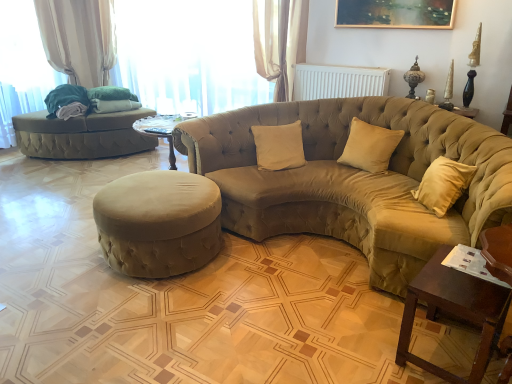
How much space does suede beige pillow at center, which ranks as the 2th pillow in left-to-right order, occupy horizontally?

12.12 inches.

The height and width of the screenshot is (384, 512). Describe the element at coordinates (369, 146) in the screenshot. I see `suede beige pillow at center, which ranks as the 2th pillow in left-to-right order` at that location.

What do you see at coordinates (354, 179) in the screenshot?
I see `velvet beige studio couch at center, the 2th studio couch in the left-to-right sequence` at bounding box center [354, 179].

Where is `white plastic radiator at upper center`? white plastic radiator at upper center is located at coordinates (338, 81).

This screenshot has width=512, height=384. What do you see at coordinates (280, 41) in the screenshot?
I see `beige fabric curtain at upper center, marked as the first curtain in a right-to-left arrangement` at bounding box center [280, 41].

This screenshot has height=384, width=512. What do you see at coordinates (158, 223) in the screenshot?
I see `suede ottoman at center` at bounding box center [158, 223].

The height and width of the screenshot is (384, 512). What do you see at coordinates (279, 146) in the screenshot?
I see `beige fabric pillow at center, the 2th pillow positioned from the right` at bounding box center [279, 146].

Identify the location of suede-like beige studio couch at left, which is the second studio couch in front-to-back order. (83, 125).

Considering the points (260, 27) and (163, 32), which point is behind, point (260, 27) or point (163, 32)?

The point (163, 32) is behind.

Is beige fabric curtain at upper center, which is counted as the first curtain, starting from the front, directly adjacent to sheer fabric curtain at upper center?

→ No, beige fabric curtain at upper center, which is counted as the first curtain, starting from the front, is not with sheer fabric curtain at upper center.

From a real-world perspective, who is located lower, beige fabric curtain at upper center, marked as the first curtain in a right-to-left arrangement, or sheer fabric curtain at upper center?

From a 3D spatial view, sheer fabric curtain at upper center is below.

Can you confirm if beige fabric curtain at upper center, the 2th curtain in the back-to-front sequence, is smaller than sheer fabric curtain at upper center?

Yes.

Based on the photo, looking at the image, does white sheer curtain at upper left, placed as the second curtain when sorted from front to back, seem bigger or smaller compared to suede-like beige studio couch at left, which is the second studio couch in front-to-back order?

white sheer curtain at upper left, placed as the second curtain when sorted from front to back, is smaller than suede-like beige studio couch at left, which is the second studio couch in front-to-back order.

In order to click on curtain behind the suede-like beige studio couch at left, which is the second studio couch in front-to-back order in this screenshot , I will do `click(79, 38)`.

Is white sheer curtain at upper left, marked as the first curtain in a back-to-front arrangement, thinner than suede-like beige studio couch at left, positioned as the 1th studio couch in back-to-front order?

Yes, white sheer curtain at upper left, marked as the first curtain in a back-to-front arrangement, is thinner than suede-like beige studio couch at left, positioned as the 1th studio couch in back-to-front order.

From the image's perspective, which is below, white sheer curtain at upper left, marked as the first curtain in a back-to-front arrangement, or suede-like beige studio couch at left, the 1th studio couch when ordered from left to right?

suede-like beige studio couch at left, the 1th studio couch when ordered from left to right, appears lower in the image.

Considering the relative sizes of suede-like beige studio couch at left, which is the second studio couch in front-to-back order, and wooden table at lower right in the image provided, is suede-like beige studio couch at left, which is the second studio couch in front-to-back order, taller than wooden table at lower right?

Indeed, suede-like beige studio couch at left, which is the second studio couch in front-to-back order, has a greater height compared to wooden table at lower right.

Which object is thinner, suede-like beige studio couch at left, marked as the 2th studio couch in a right-to-left arrangement, or wooden table at lower right?

wooden table at lower right is thinner.

Is suede-like beige studio couch at left, positioned as the 1th studio couch in back-to-front order, smaller than wooden table at lower right?

Actually, suede-like beige studio couch at left, positioned as the 1th studio couch in back-to-front order, might be larger than wooden table at lower right.

What are the coordinates of `table lying on the right of suede-like beige studio couch at left, which is the second studio couch in front-to-back order` in the screenshot? It's located at (454, 312).

Relative to beige fabric curtain at upper center, the second curtain in the left-to-right sequence, is white sheer curtain at upper left, marked as the first curtain in a back-to-front arrangement, in front or behind?

Answer: Visually, white sheer curtain at upper left, marked as the first curtain in a back-to-front arrangement, is located behind beige fabric curtain at upper center, the second curtain in the left-to-right sequence.

From the image's perspective, which one is positioned higher, white sheer curtain at upper left, placed as the second curtain when sorted from front to back, or beige fabric curtain at upper center, the second curtain in the left-to-right sequence?

From the image's view, white sheer curtain at upper left, placed as the second curtain when sorted from front to back, is above.

Considering the relative positions of white sheer curtain at upper left, marked as the first curtain in a back-to-front arrangement, and beige fabric curtain at upper center, marked as the first curtain in a right-to-left arrangement, in the image provided, is white sheer curtain at upper left, marked as the first curtain in a back-to-front arrangement, to the left of beige fabric curtain at upper center, marked as the first curtain in a right-to-left arrangement, from the viewer's perspective?

Indeed, white sheer curtain at upper left, marked as the first curtain in a back-to-front arrangement, is positioned on the left side of beige fabric curtain at upper center, marked as the first curtain in a right-to-left arrangement.

From a real-world perspective, is white sheer curtain at upper left, marked as the first curtain in a back-to-front arrangement, positioned above or below beige fabric curtain at upper center, which is counted as the first curtain, starting from the front?

white sheer curtain at upper left, marked as the first curtain in a back-to-front arrangement, is situated lower than beige fabric curtain at upper center, which is counted as the first curtain, starting from the front, in the real world.

In the scene shown: Which of these two, white sheer curtain at upper left, acting as the 2th curtain starting from the right, or wooden table at lower right, is smaller?

Smaller between the two is wooden table at lower right.

You are a GUI agent. You are given a task and a screenshot of the screen. Output one action in this format:
    pyautogui.click(x=<x>, y=<y>)
    Task: Click on the 2nd curtain behind the wooden table at lower right, starting your count from the anchor
    The height and width of the screenshot is (384, 512).
    Given the screenshot: What is the action you would take?
    click(79, 38)

From the image's perspective, is white sheer curtain at upper left, the 1th curtain when ordered from left to right, located above wooden table at lower right?

Yes, from the image's perspective, white sheer curtain at upper left, the 1th curtain when ordered from left to right, is over wooden table at lower right.

Between white sheer curtain at upper left, placed as the second curtain when sorted from front to back, and wooden table at lower right, which one has less height?

wooden table at lower right.

Are beige fabric pillow at center, which is the first pillow in left-to-right order, and suede-like beige studio couch at left, positioned as the 1th studio couch in back-to-front order, located far from each other?

Absolutely, beige fabric pillow at center, which is the first pillow in left-to-right order, is distant from suede-like beige studio couch at left, positioned as the 1th studio couch in back-to-front order.

Measure the distance between beige fabric pillow at center, which is the first pillow in left-to-right order, and suede-like beige studio couch at left, which is the second studio couch in front-to-back order.

A distance of 2.16 meters exists between beige fabric pillow at center, which is the first pillow in left-to-right order, and suede-like beige studio couch at left, which is the second studio couch in front-to-back order.

From a real-world perspective, between beige fabric pillow at center, the 2th pillow positioned from the right, and suede-like beige studio couch at left, the 1th studio couch when ordered from left to right, who is vertically lower?

suede-like beige studio couch at left, the 1th studio couch when ordered from left to right.

Does point (265, 149) come in front of point (50, 110)?

That is True.

Does beige fabric curtain at upper center, the 2th curtain in the back-to-front sequence, turn towards suede ottoman at center?

Yes, beige fabric curtain at upper center, the 2th curtain in the back-to-front sequence, is oriented towards suede ottoman at center.

Is beige fabric curtain at upper center, marked as the first curtain in a right-to-left arrangement, thinner than suede ottoman at center?

Correct, the width of beige fabric curtain at upper center, marked as the first curtain in a right-to-left arrangement, is less than that of suede ottoman at center.

Looking at this image, from their relative heights in the image, would you say beige fabric curtain at upper center, which is counted as the first curtain, starting from the front, is taller or shorter than suede ottoman at center?

beige fabric curtain at upper center, which is counted as the first curtain, starting from the front, is taller than suede ottoman at center.

From the image's perspective, which object appears higher, beige fabric curtain at upper center, which is counted as the first curtain, starting from the front, or suede ottoman at center?

From the image's view, beige fabric curtain at upper center, which is counted as the first curtain, starting from the front, is above.

Image resolution: width=512 pixels, height=384 pixels. What are the coordinates of `curtain on the right of the sheer fabric curtain at upper center` in the screenshot? It's located at (280, 41).

You are a GUI agent. You are given a task and a screenshot of the screen. Output one action in this format:
    pyautogui.click(x=<x>, y=<y>)
    Task: Click on the curtain behind the suede-like beige studio couch at left, which is the second studio couch in front-to-back order
    
    Given the screenshot: What is the action you would take?
    tap(79, 38)

Consider the image. Estimate the real-world distances between objects in this image. Which object is further from beige fabric pillow at center, which is the first pillow in left-to-right order, white sheer curtain at upper left, marked as the first curtain in a back-to-front arrangement, or suede-like beige studio couch at left, the 1th studio couch when ordered from left to right?

white sheer curtain at upper left, marked as the first curtain in a back-to-front arrangement.

Which object lies nearer to the anchor point white plastic radiator at upper center, suede ottoman at center or sheer fabric curtain at upper center?

Among the two, sheer fabric curtain at upper center is located nearer to white plastic radiator at upper center.

From the image, which object appears to be farther from sheer fabric curtain at upper center, suede beige pillow at center, placed as the 1th pillow when sorted from right to left, or wooden table at lower right?

wooden table at lower right is further to sheer fabric curtain at upper center.

When comparing their distances from sheer fabric curtain at upper center, does velvet beige studio couch at center, the 2th studio couch in the left-to-right sequence, or wooden table at lower right seem closer?

velvet beige studio couch at center, the 2th studio couch in the left-to-right sequence, lies closer to sheer fabric curtain at upper center than the other object.

From the image, which object appears to be farther from wooden table at lower right, white plastic radiator at upper center or beige fabric curtain at upper center, the second curtain in the left-to-right sequence?

Among the two, beige fabric curtain at upper center, the second curtain in the left-to-right sequence, is located further to wooden table at lower right.

Looking at the image, which one is located further to sheer fabric curtain at upper center, beige fabric curtain at upper center, the second curtain in the left-to-right sequence, or velvet beige studio couch at center, marked as the first studio couch in a right-to-left arrangement?

Based on the image, velvet beige studio couch at center, marked as the first studio couch in a right-to-left arrangement, appears to be further to sheer fabric curtain at upper center.

From the image, which object appears to be nearer to sheer fabric curtain at upper center, wooden table at lower right or suede ottoman at center?

The object closer to sheer fabric curtain at upper center is suede ottoman at center.

From the image, which object appears to be farther from beige fabric pillow at center, which is the first pillow in left-to-right order, suede-like beige studio couch at left, the 1th studio couch when ordered from left to right, or white plastic radiator at upper center?

suede-like beige studio couch at left, the 1th studio couch when ordered from left to right, is further to beige fabric pillow at center, which is the first pillow in left-to-right order.

I want to click on studio couch between suede-like beige studio couch at left, the 1th studio couch when ordered from left to right, and white plastic radiator at upper center, in the horizontal direction, so click(x=354, y=179).

Locate an element on the screen. curtain situated between suede-like beige studio couch at left, positioned as the 1th studio couch in back-to-front order, and wooden table at lower right from left to right is located at coordinates (280, 41).

Where is `radiator between white sheer curtain at upper left, acting as the 2th curtain starting from the right, and wooden table at lower right, in the horizontal direction`? Image resolution: width=512 pixels, height=384 pixels. radiator between white sheer curtain at upper left, acting as the 2th curtain starting from the right, and wooden table at lower right, in the horizontal direction is located at coordinates click(338, 81).

The image size is (512, 384). I want to click on studio couch situated between white sheer curtain at upper left, the 1th curtain when ordered from left to right, and beige fabric curtain at upper center, marked as the first curtain in a right-to-left arrangement, from left to right, so click(83, 125).